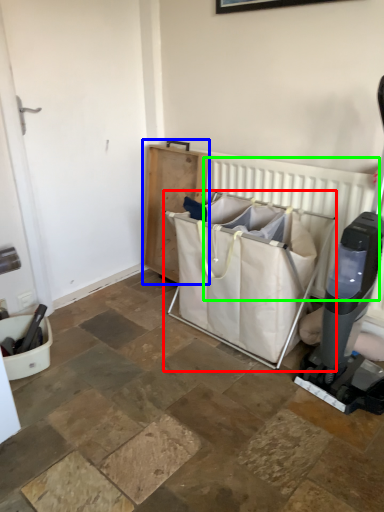
Question: Which object is the farthest from baby carriage (highlighted by a red box)? Choose among these: furniture (highlighted by a blue box) or radiator (highlighted by a green box).

Choices:
 (A) furniture
 (B) radiator

Answer: (A)